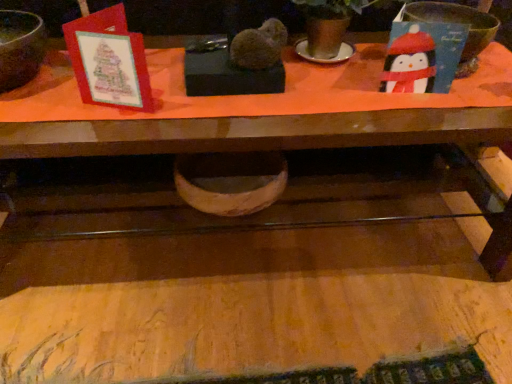
You are a GUI agent. You are given a task and a screenshot of the screen. Output one action in this format:
    pyautogui.click(x=<x>, y=<y>)
    Task: Click on the free space in front of matte black bowl at right, positioned as the 1th basin in right-to-left order
    The height and width of the screenshot is (384, 512).
    Given the screenshot: What is the action you would take?
    pyautogui.click(x=448, y=107)